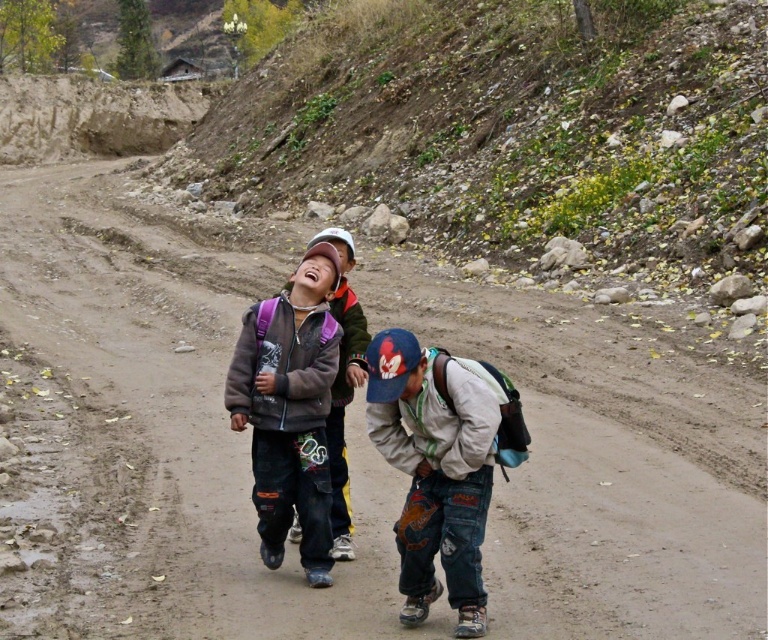
You are a photographer trying to capture a candid shot of the laughing child wearing the matte gray jacket at center and the matte blue backpack at center. To ensure both items are clearly visible, you need to know which one is larger. Can you tell me which object is bigger?

The matte gray jacket at center is bigger than the matte blue backpack at center, so the jacket will be more clearly visible in the photo.

You are a photographer trying to capture a candid shot of the child in the center. You notice the denim pants at center and the matte blue backpack at center. Which object is closer to the camera?

The denim pants at center is positioned under matte blue backpack at center, meaning the denim pants at center is closer to the camera since it is below the backpack.